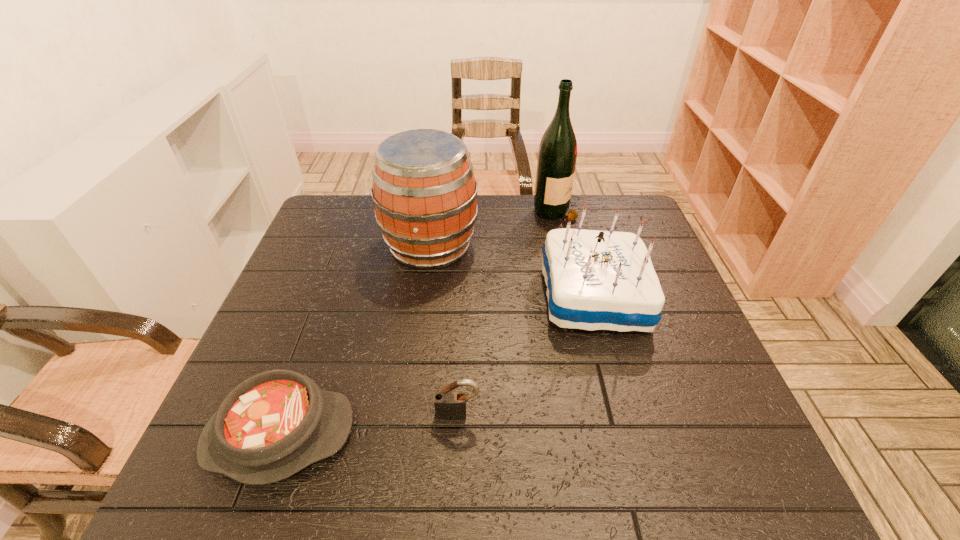
What are the coordinates of `wine bottle situated at the far edge` in the screenshot? It's located at (557, 154).

Locate an element on the screen. cider that is at the far edge is located at coordinates (424, 191).

Image resolution: width=960 pixels, height=540 pixels. Find the location of `object positioned at the near edge`. object positioned at the near edge is located at coordinates (274, 424).

This screenshot has width=960, height=540. I want to click on object that is at the left edge, so click(274, 424).

Locate an element on the screen. Image resolution: width=960 pixels, height=540 pixels. object that is at the right edge is located at coordinates (596, 280).

Find the location of a particular element. object that is at the near left corner is located at coordinates (274, 424).

Where is `vacant space at the near edge of the desktop`? vacant space at the near edge of the desktop is located at coordinates (287, 486).

Where is `vacant area at the left edge`? This screenshot has height=540, width=960. vacant area at the left edge is located at coordinates (x=344, y=246).

In the image, there is a desktop. Where is `vacant space at the right edge`? This screenshot has width=960, height=540. vacant space at the right edge is located at coordinates (702, 364).

Identify the location of free space at the far left corner of the desktop. Image resolution: width=960 pixels, height=540 pixels. (348, 231).